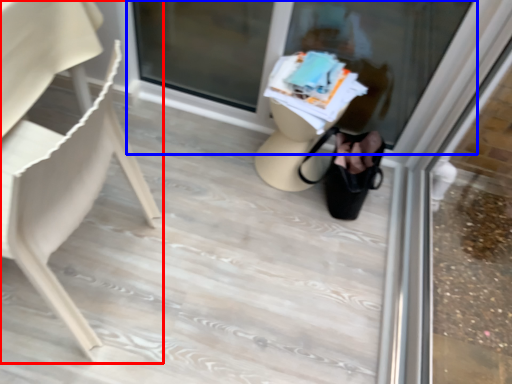
Question: Which point is further to the camera, chair (highlighted by a red box) or shop window (highlighted by a blue box)?

Choices:
 (A) chair
 (B) shop window

Answer: (B)